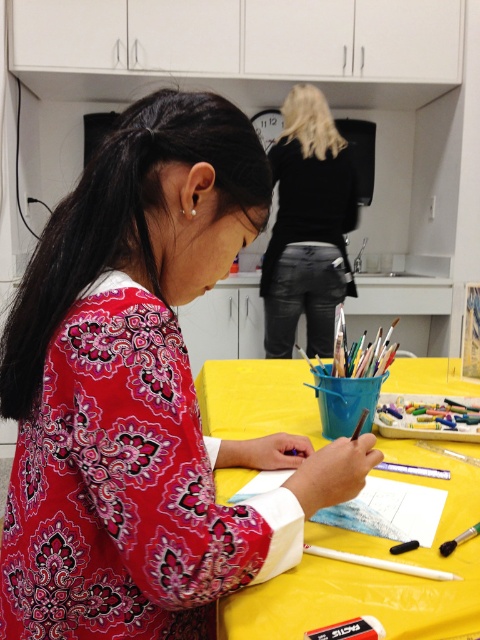
Question: Among these objects, which one is nearest to the camera?

Choices:
 (A) yellow fabric table at center
 (B) patterned fabric shirt at center

Answer: (B)

Question: Can you confirm if patterned fabric shirt at center is smaller than black leather jacket at upper center?

Choices:
 (A) no
 (B) yes

Answer: (B)

Question: Does patterned fabric shirt at center appear on the right side of black leather jacket at upper center?

Choices:
 (A) yes
 (B) no

Answer: (B)

Question: Estimate the real-world distances between objects in this image. Which object is farther from the black leather jacket at upper center?

Choices:
 (A) patterned fabric shirt at center
 (B) yellow fabric table at center

Answer: (A)

Question: Does patterned fabric shirt at center have a greater width compared to yellow fabric table at center?

Choices:
 (A) no
 (B) yes

Answer: (A)

Question: Which of the following is the farthest from the observer?

Choices:
 (A) (456, 525)
 (B) (283, 160)
 (C) (136, 566)

Answer: (B)